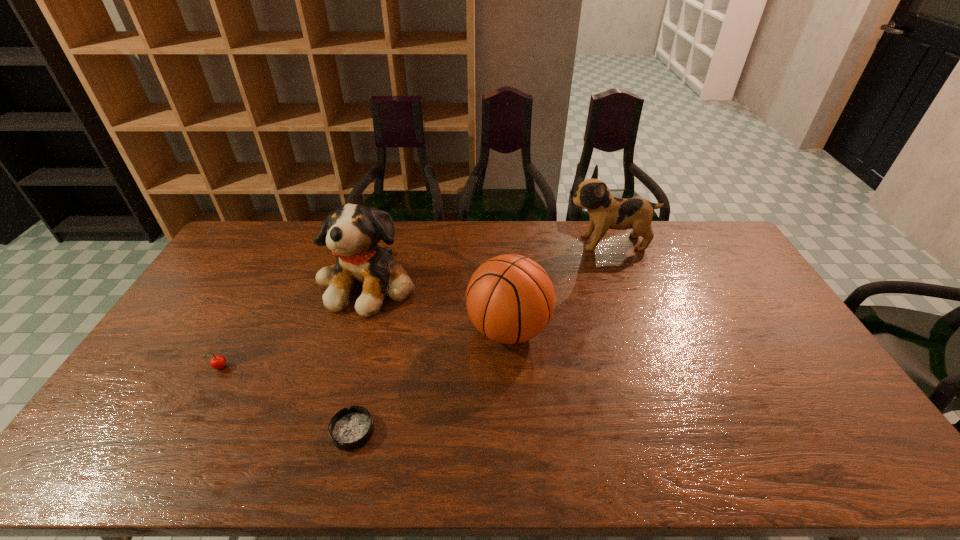
Find the location of a particular element. the right puppy is located at coordinates (606, 212).

Identify the location of the left puppy. (352, 232).

This screenshot has width=960, height=540. I want to click on the second object from right to left, so tap(510, 298).

This screenshot has height=540, width=960. What are the coordinates of `the fourth tallest object` in the screenshot? It's located at (217, 362).

The image size is (960, 540). I want to click on the leftmost object, so click(x=217, y=362).

Locate an element on the screen. The width and height of the screenshot is (960, 540). the shortest object is located at coordinates (350, 428).

You are a GUI agent. You are given a task and a screenshot of the screen. Output one action in this format:
    pyautogui.click(x=<x>, y=<y>)
    Task: Click on the nearest object
    Image resolution: width=960 pixels, height=540 pixels.
    Given the screenshot: What is the action you would take?
    pyautogui.click(x=350, y=428)

In order to click on vacant space situated 0.070m at the face of the rightmost object in this screenshot , I will do `click(548, 243)`.

Where is `vacant space located at the face of the rightmost object`? The width and height of the screenshot is (960, 540). vacant space located at the face of the rightmost object is located at coordinates (515, 243).

I want to click on vacant space located at the face of the rightmost object, so click(x=540, y=243).